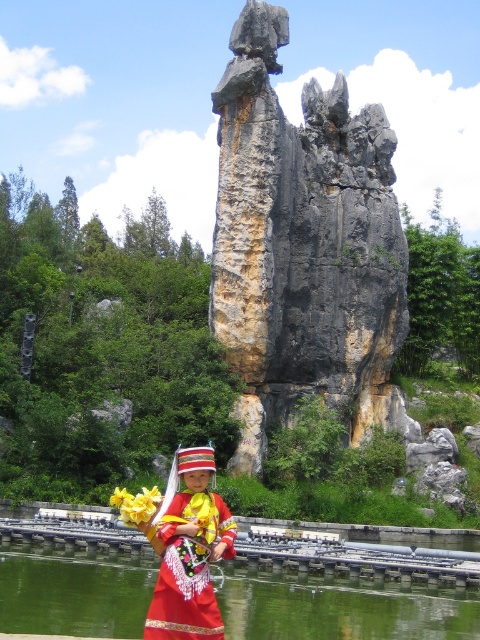
Which is behind, point (96, 611) or point (184, 502)?

The point (96, 611) is more distant.

Which is above, green smooth water at lower center or red satin dress at center?

Positioned higher is red satin dress at center.

What do you see at coordinates (339, 608) in the screenshot?
I see `green smooth water at lower center` at bounding box center [339, 608].

Identify the location of green smooth water at lower center. (339, 608).

Is red satin dress at center bigger than yellow fabric flower at lower center?

Correct, red satin dress at center is larger in size than yellow fabric flower at lower center.

Between point (167, 516) and point (113, 497), which one is positioned in front?

Point (167, 516)

This screenshot has width=480, height=640. Identify the location of red satin dress at center. (190, 552).

Can you confirm if green smooth water at lower center is wider than yellow fabric flower at lower center?

Correct, the width of green smooth water at lower center exceeds that of yellow fabric flower at lower center.

Is point (444, 604) in front of point (135, 516)?

No.

Does point (423, 618) come farther from viewer compared to point (151, 515)?

Yes, point (423, 618) is farther from viewer.

The image size is (480, 640). Identify the location of green smooth water at lower center. (339, 608).